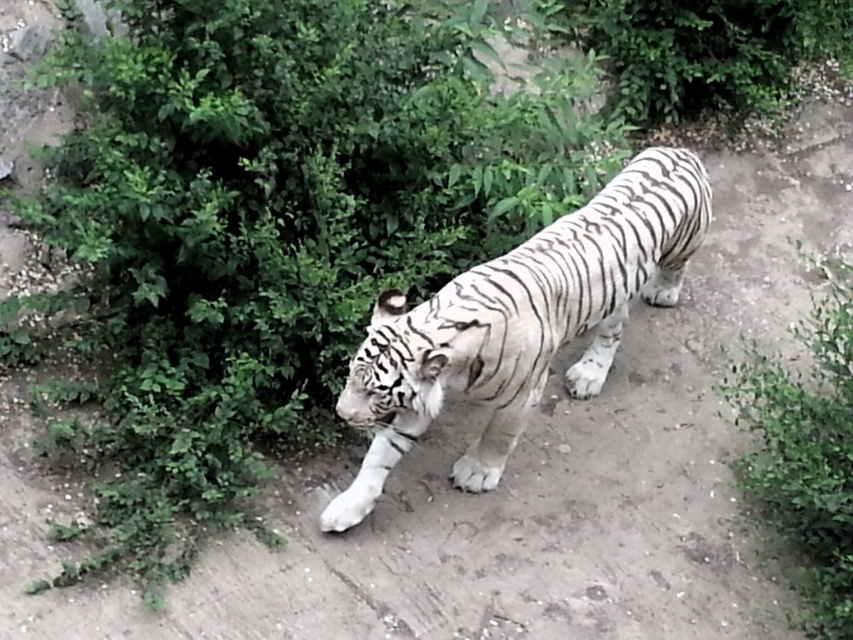
You are a wildlife photographer trying to capture a photo of the white striped tiger at center and the green leafy bush at lower right. Based on their positions, which object is closer to the left edge of the image?

The white striped tiger at center is positioned on the left side of green leafy bush at lower right, so it is closer to the left edge of the image.

You are a zookeeper who needs to place a feeding station between the white striped tiger at center and the green leafy bush at lower right. The feeding station requires a minimum of 24 inches of space to be placed safely. Based on the scene, can you place it there?

The distance between the white striped tiger at center and the green leafy bush at lower right is 23.03 inches, which is less than the required 24 inches. Therefore, the feeding station cannot be placed there safely.

You are a photographer trying to capture the white tiger in the image. You want to focus on the point at point (538,269) and point (766,392). Which point should you focus on first to ensure it appears sharp in the photo?

You should focus on point (538,269) first because it is closer to the camera than point (766,392), so it will be in focus before the other point.